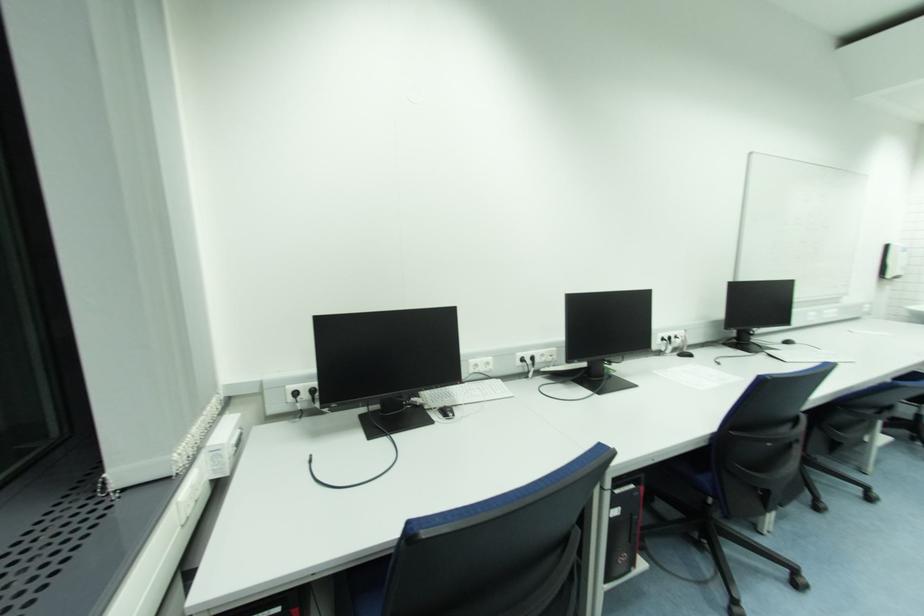
Locate an element on the screen. Image resolution: width=924 pixels, height=616 pixels. dispenser lever is located at coordinates (894, 261).